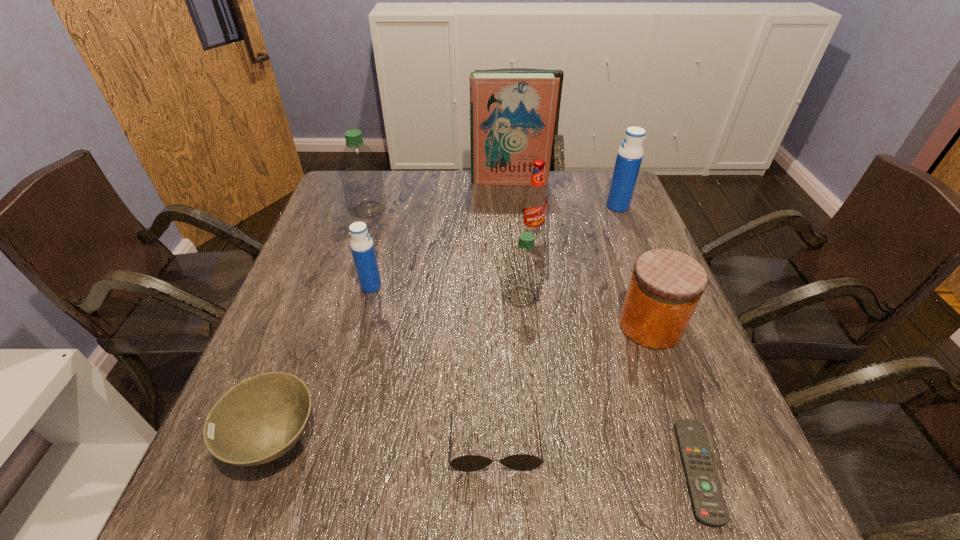
Where is `blank space located 0.390m on the front of the farther green water bottle`? blank space located 0.390m on the front of the farther green water bottle is located at coordinates (331, 324).

Find the location of a particular element. Image resolution: width=960 pixels, height=540 pixels. vacant space located 0.200m on the right of the seventh nearest object is located at coordinates (615, 234).

Locate an element on the screen. vacant region located on the right of the left blue water bottle is located at coordinates (427, 286).

You are a GUI agent. You are given a task and a screenshot of the screen. Output one action in this format:
    pyautogui.click(x=<x>, y=<y>)
    Task: Click on the vacant space located on the back of the second water bottle from right to left
    This screenshot has height=540, width=960.
    Given the screenshot: What is the action you would take?
    pyautogui.click(x=515, y=223)

This screenshot has width=960, height=540. Find the location of `vacant position located on the front of the orange jar`. vacant position located on the front of the orange jar is located at coordinates (685, 420).

Locate an element on the screen. free location located on the right of the bowl is located at coordinates (355, 440).

At what (x,y) coordinates should I click in order to perform the action: click on vacant space located 0.270m on the left of the remote control. Please return your answer as a coordinate pair (x, y). The width and height of the screenshot is (960, 540). Looking at the image, I should click on (518, 470).

I want to click on hardback book present at the far edge, so click(512, 114).

Locate an element on the screen. bowl situated at the near edge is located at coordinates (262, 418).

What are the coordinates of `sunglasses that is at the near edge` in the screenshot? It's located at (522, 462).